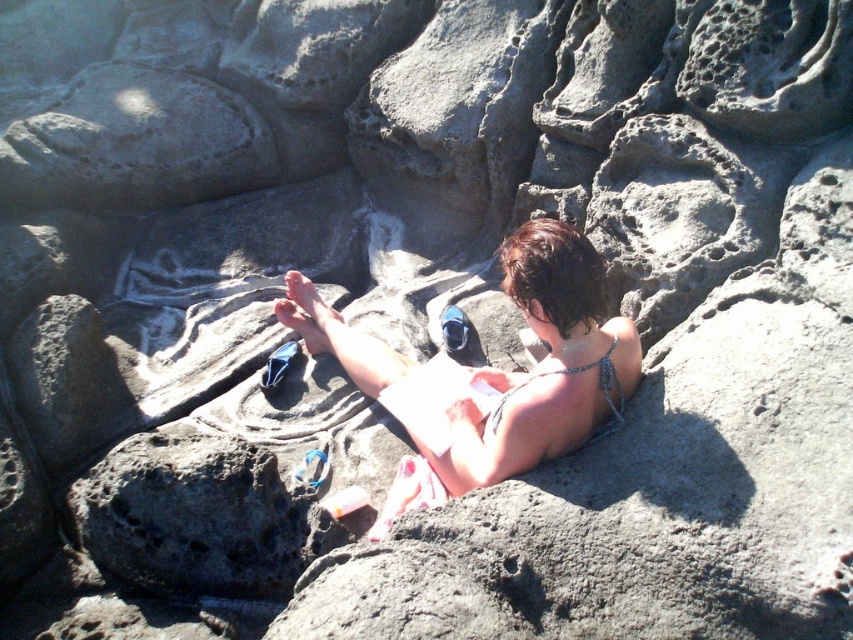
You are a photographer taking a beach portrait and need to ensure the white fabric bikini at center and the sparkly silver bikini top at center are both visible in the frame. Given their size difference, which bikini should you focus on to ensure both are fully captured?

The white fabric bikini at center is larger in size than the sparkly silver bikini top at center, so focusing on the white fabric bikini at center will help ensure both are fully visible in the frame.

You are a photographer trying to capture the perfect shot of the white fabric bikini at center and the sparkly silver bikini top at center. Which one should you focus on if you want to include both in your frame without cropping either?

You should focus on the white fabric bikini at center because it is positioned to the left of the sparkly silver bikini top at center, allowing both to be included in the frame when centered appropriately.

In the scene shown: You are a photographer trying to capture the best angle of the person on the beach. Since you want to highlight both the white fabric bikini at center and the sparkly silver bikini top at center, which one should you focus on first to ensure both are visible in the frame?

The white fabric bikini at center is located above the sparkly silver bikini top at center, so focusing on the white fabric bikini at center first will ensure the sparkly silver bikini top at center remains in the frame below it.